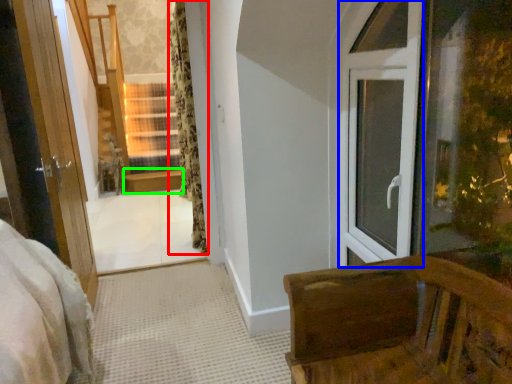
Question: Considering the real-world distances, which object is closest to curtain (highlighted by a red box)? window frame (highlighted by a blue box) or window sill (highlighted by a green box).

Choices:
 (A) window frame
 (B) window sill

Answer: (B)